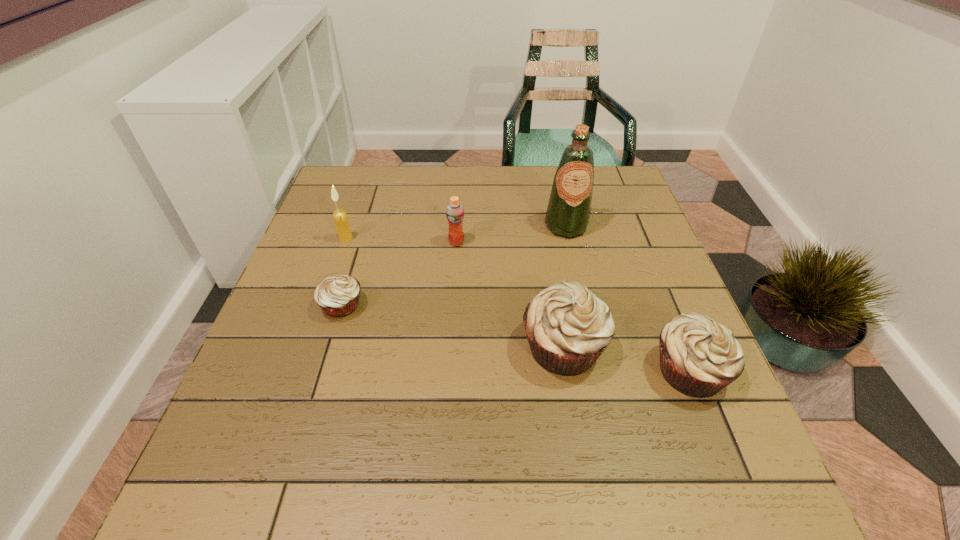
Locate an element on the screen. The width and height of the screenshot is (960, 540). spot to insert another muffin for uniform distribution is located at coordinates (447, 325).